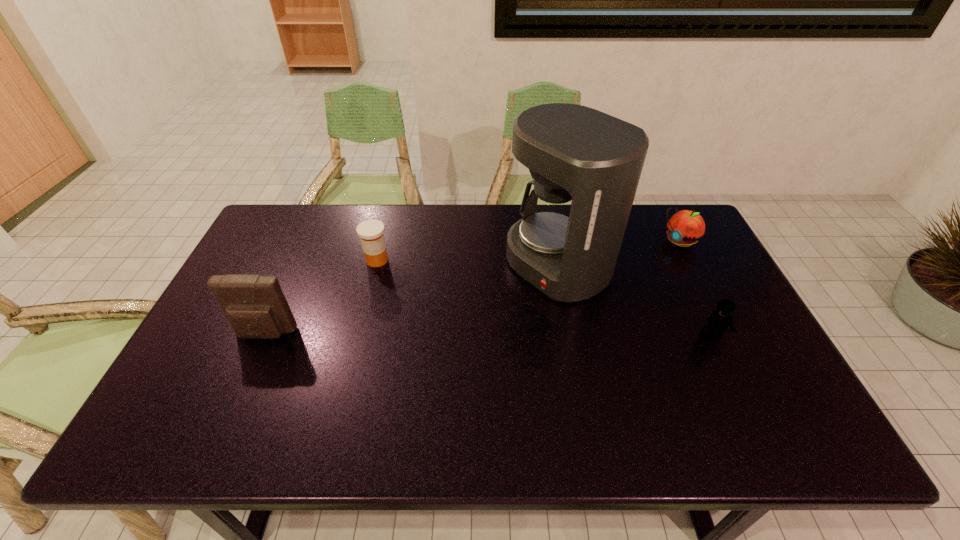
At what (x,y) coordinates should I click in order to perform the action: click on free space on the desktop that is between the second tallest object and the Lego and is positioned on the label of the medicine. Please return your answer as a coordinate pair (x, y). Looking at the image, I should click on (458, 335).

Image resolution: width=960 pixels, height=540 pixels. I want to click on vacant spot on the desktop that is between the pouch and the Lego and is positioned on the front-facing side of the coffee maker, so click(x=452, y=335).

Image resolution: width=960 pixels, height=540 pixels. In order to click on vacant spot on the desktop that is between the fourth shortest object and the Lego and is positioned on the surface of the apple in this screenshot , I will do `click(553, 336)`.